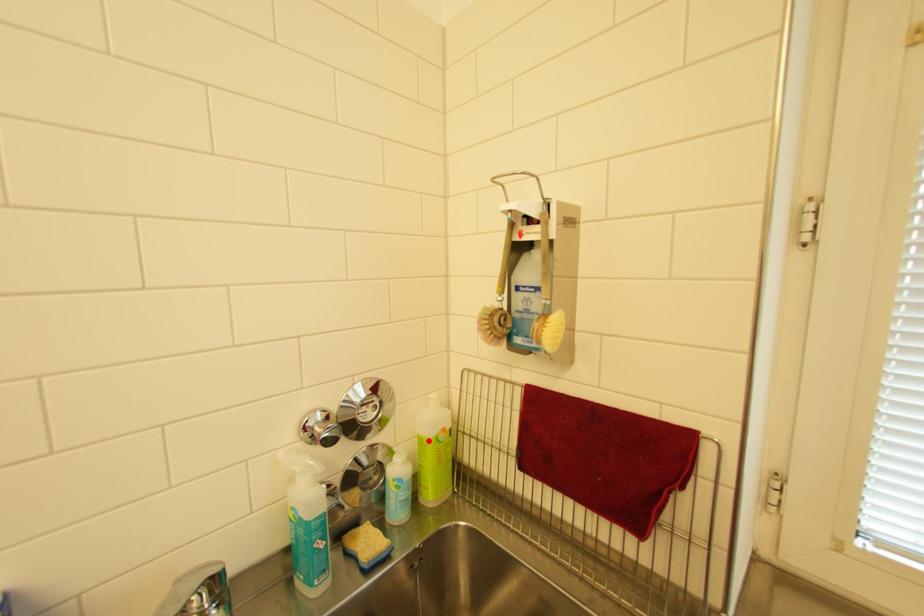
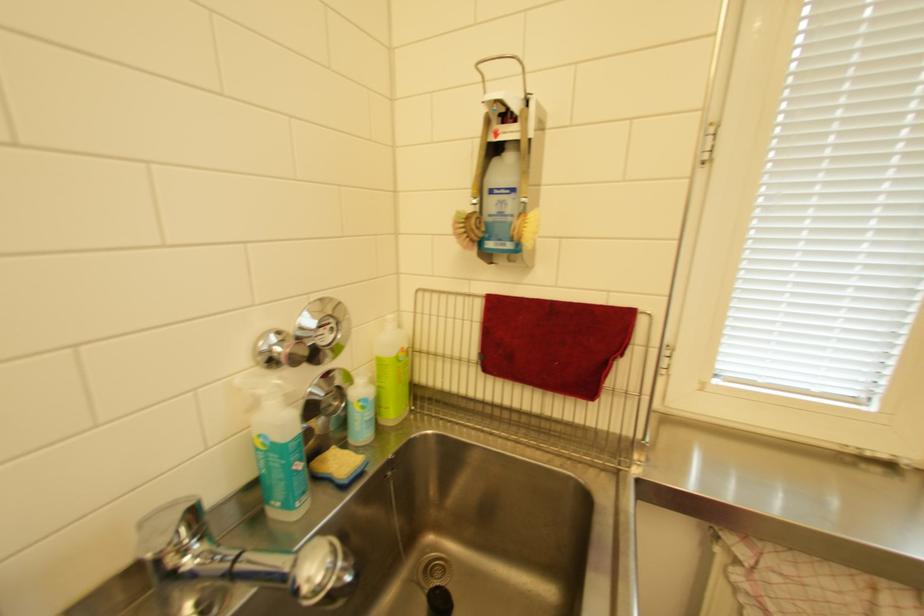
The point at the highlighted location is marked in the first image. Where is the corresponding point in the second image?

(386, 362)